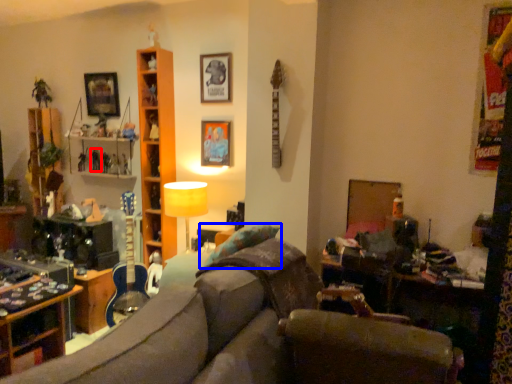
Question: Which object appears farthest to the camera in this image, toy (highlighted by a red box) or pillow (highlighted by a blue box)?

Choices:
 (A) toy
 (B) pillow

Answer: (A)